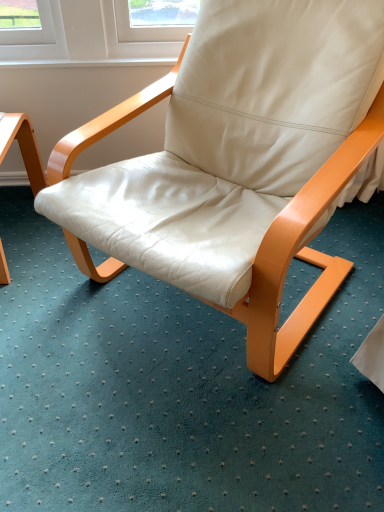
The image size is (384, 512). What do you see at coordinates (237, 163) in the screenshot? I see `white leather chair at center` at bounding box center [237, 163].

Find the location of a particular element. The height and width of the screenshot is (512, 384). white leather chair at center is located at coordinates (237, 163).

This screenshot has width=384, height=512. Find the location of `white leather chair at center`. white leather chair at center is located at coordinates (237, 163).